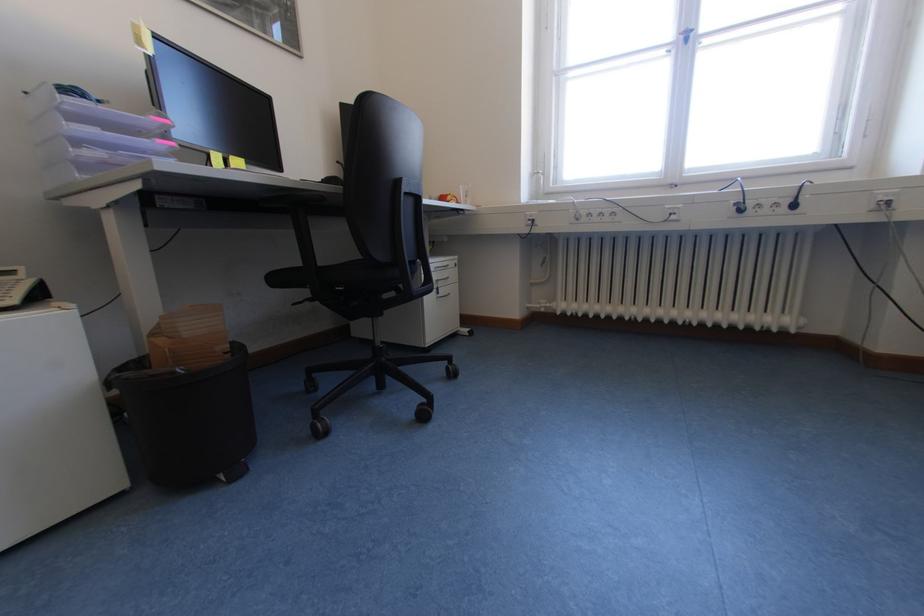
What do you see at coordinates (20, 289) in the screenshot? This screenshot has height=616, width=924. I see `the telephone handset` at bounding box center [20, 289].